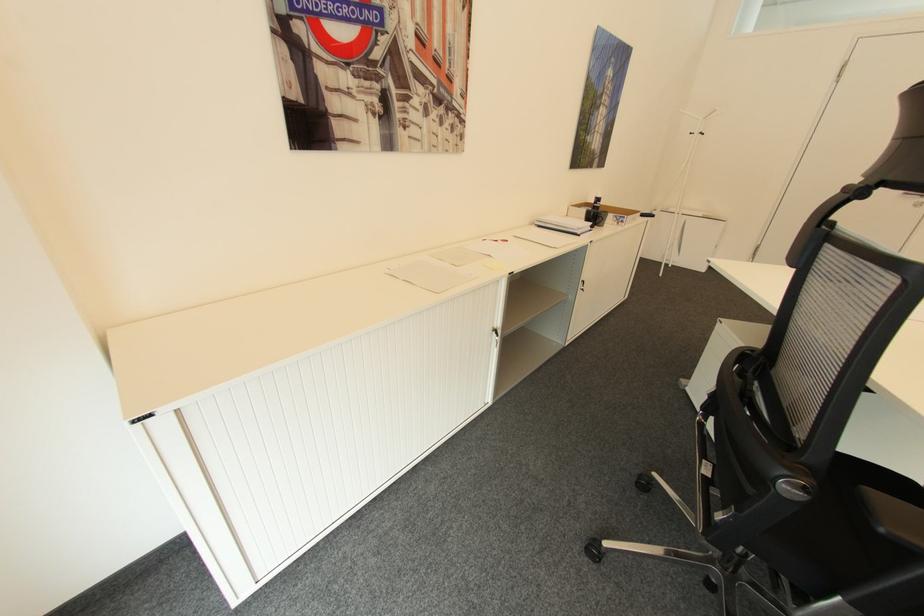
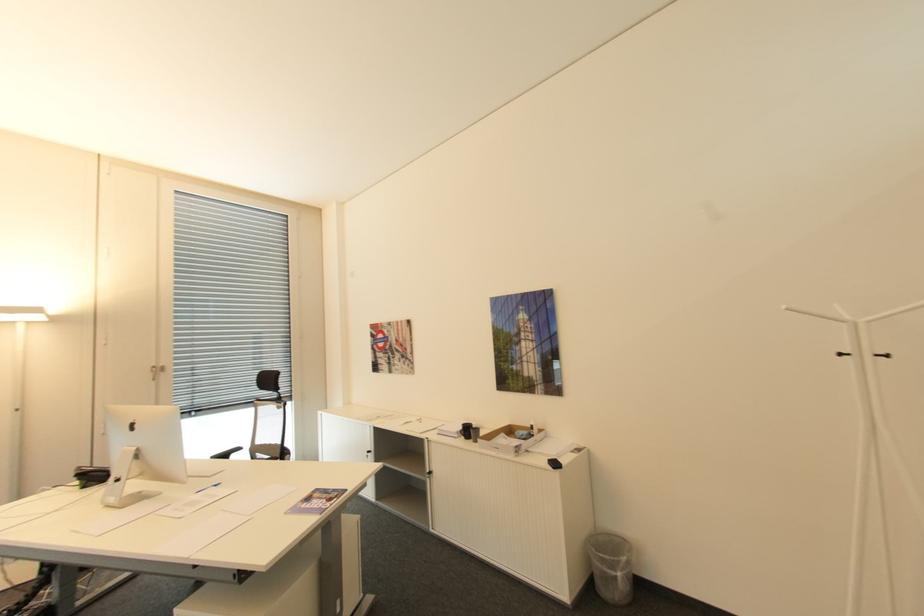
The point at (708, 134) is marked in the first image. Where is the corresponding point in the second image?

(894, 355)